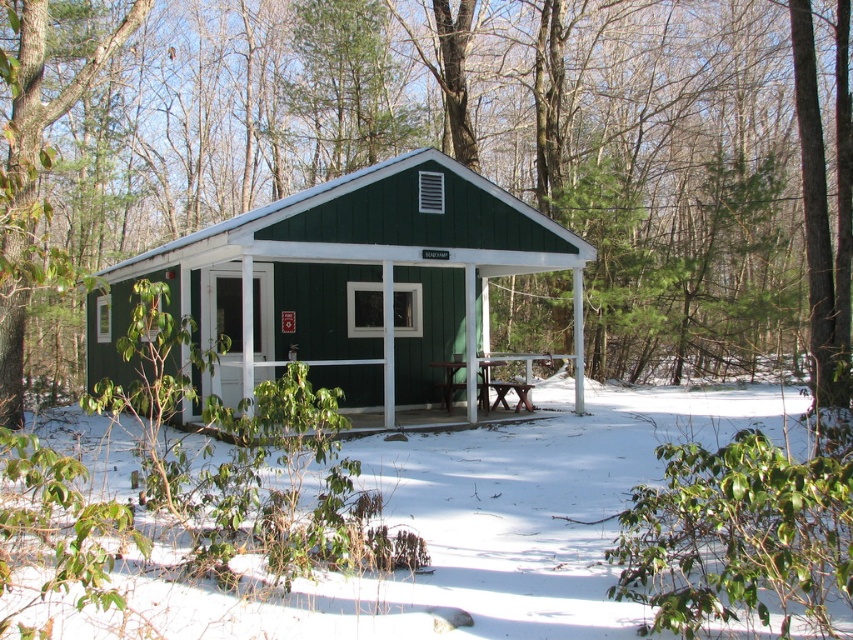
You are standing in front of the cabin and want to move to the porch. Which direction should you go relative to the green matte cabin at center and the green wood porch at center?

Since the green matte cabin at center is to the left of the green wood porch at center, you should move to the right from the green matte cabin at center to reach the green wood porch at center.

You are planning to install a new flagpole in front of the green matte cabin at center and the brown wooden picnic table at lower center. Since the flagpole must be at least 2 meters taller than the tallest object in the scene, which object should the flagpole be compared to?

The green matte cabin at center is taller than the brown wooden picnic table at lower center, so the flagpole must be at least 2 meters taller than the green matte cabin at center to meet the requirement.

You are standing in front of the cabin and want to enter through the door. Which object, the green matte cabin at center or the green wood porch at center, do you need to step onto first?

You need to step onto the green wood porch at center first because the green matte cabin at center is positioned over it, meaning the porch is below the cabin structure and serves as its base.